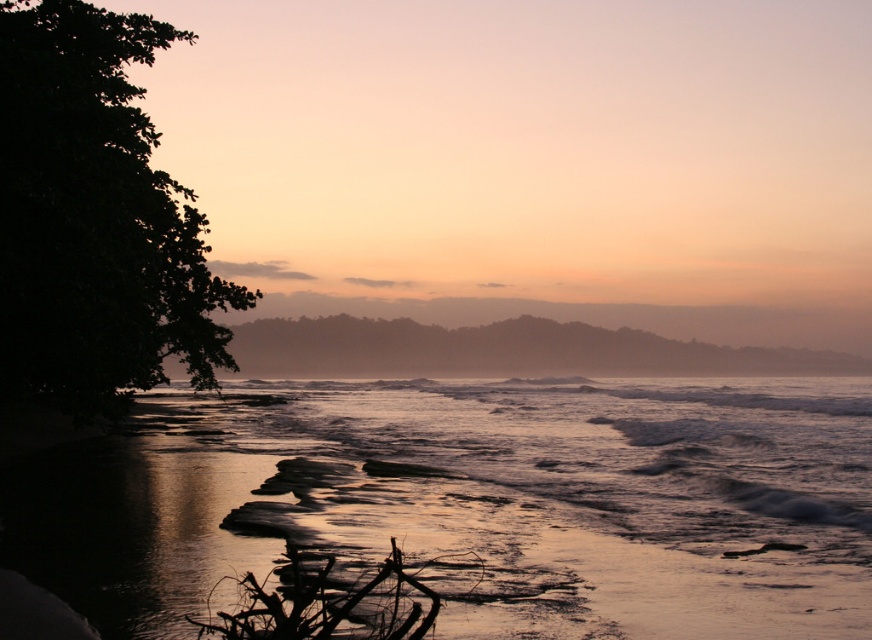
Question: Does shiny wet sand at lower center appear under dark green leafy tree at left?

Choices:
 (A) yes
 (B) no

Answer: (A)

Question: Which point is closer to the camera?

Choices:
 (A) dark green leafy tree at left
 (B) shiny wet sand at lower center

Answer: (B)

Question: Can you confirm if shiny wet sand at lower center is positioned above dark green leafy tree at left?

Choices:
 (A) yes
 (B) no

Answer: (B)

Question: Is shiny wet sand at lower center to the right of dark green leafy tree at left from the viewer's perspective?

Choices:
 (A) no
 (B) yes

Answer: (B)

Question: Which object is closer to the camera taking this photo?

Choices:
 (A) shiny wet sand at lower center
 (B) dark green leafy tree at left

Answer: (A)